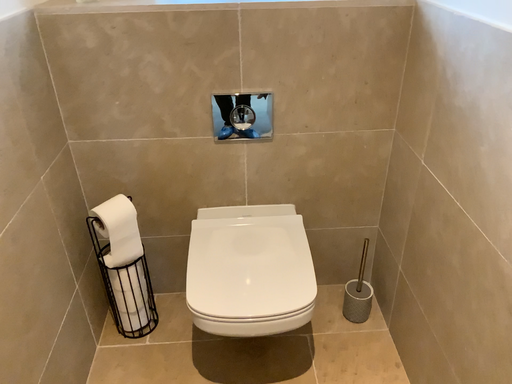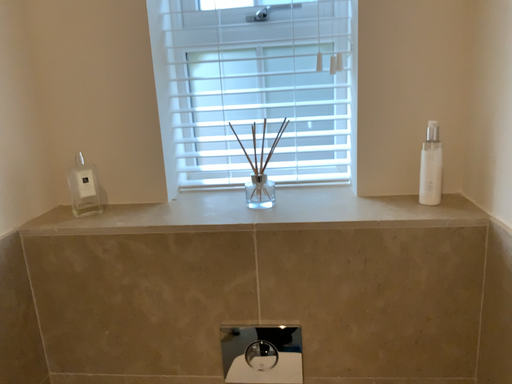
Question: How did the camera likely rotate when shooting the video?

Choices:
 (A) rotated left
 (B) rotated right

Answer: (A)